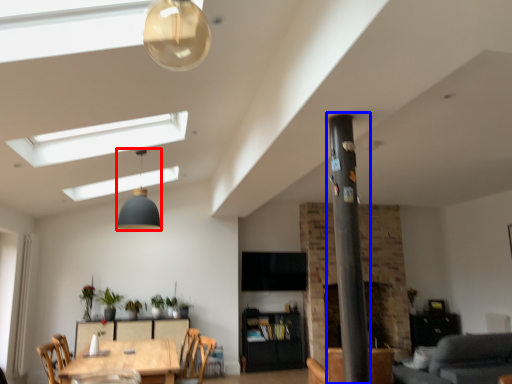
Question: Which object appears closest to the camera in this image, light fixture (highlighted by a red box) or pillar (highlighted by a blue box)?

Choices:
 (A) light fixture
 (B) pillar

Answer: (B)